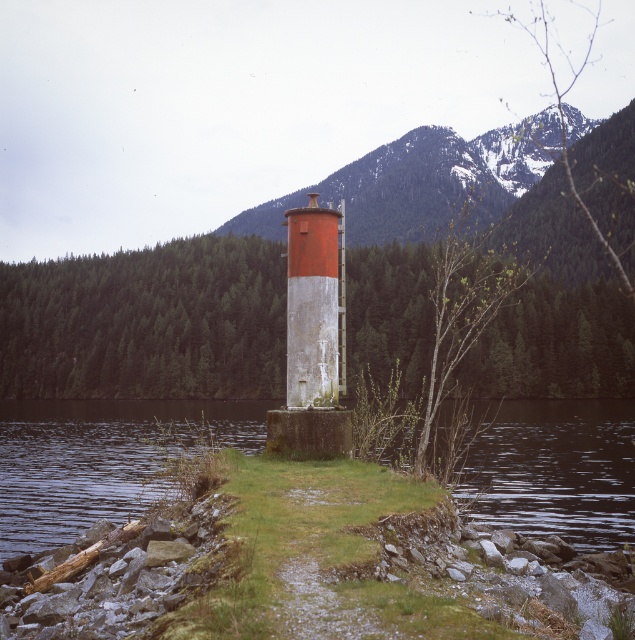
You are a hiker standing at the base of the snowy rocky mountain at center and want to reach the red painted concrete tower at center. Which direction should you move relative to the mountain to reach the tower?

The snowy rocky mountain at center is positioned on the right side of the red painted concrete tower at center, so to reach the tower from the mountain, you should move to the left relative to the mountain.

You are standing at the base of the snowy rocky mountain at center. You see a point marked at coordinates (422, 180). Is this point located on the mountain itself or somewhere else?

The point marked at coordinates (422, 180) is located on the snowy rocky mountain at center.

You are standing on the grassy area near the red painted concrete tower at center and want to reach the clear water at lower center. Which direction should you move relative to the tower?

The clear water at lower center is positioned on the left side of red painted concrete tower at center, so you should move to the left of the tower to reach the clear water at lower center.